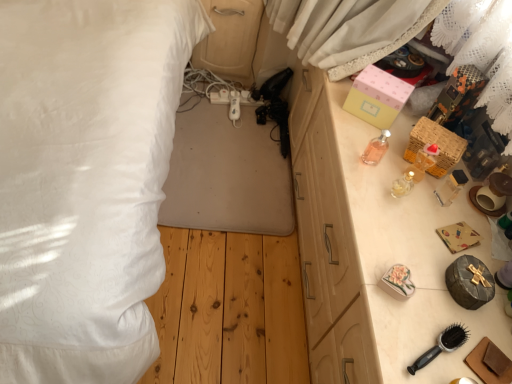
Find the location of a particular element. This screenshot has height=384, width=512. vacant space behind pink glass perfume at upper right is located at coordinates (356, 121).